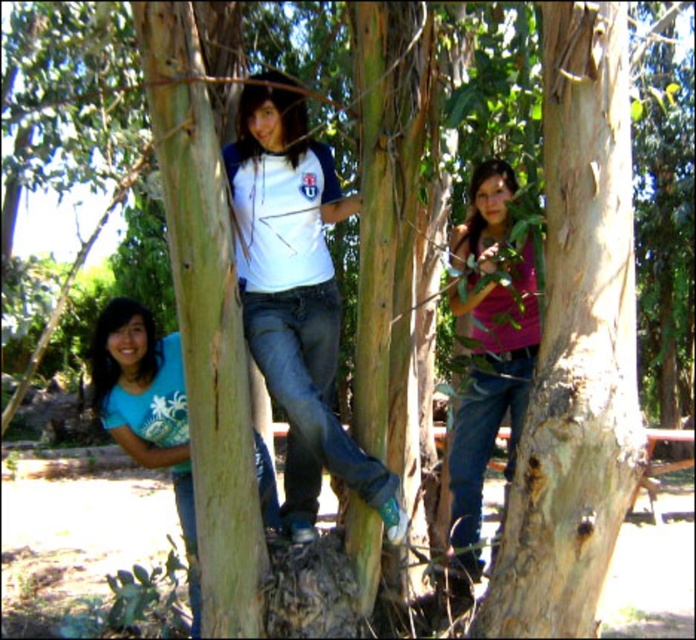
Which of these two, pink matte shirt at center or blue denim jeans at lower left, stands taller?

With more height is pink matte shirt at center.

Is pink matte shirt at center positioned behind blue denim jeans at lower left?

No, it is in front of blue denim jeans at lower left.

Which is behind, point (490, 444) or point (120, 422)?

Point (490, 444)

Identify the location of pink matte shirt at center. The height and width of the screenshot is (640, 696). (489, 353).